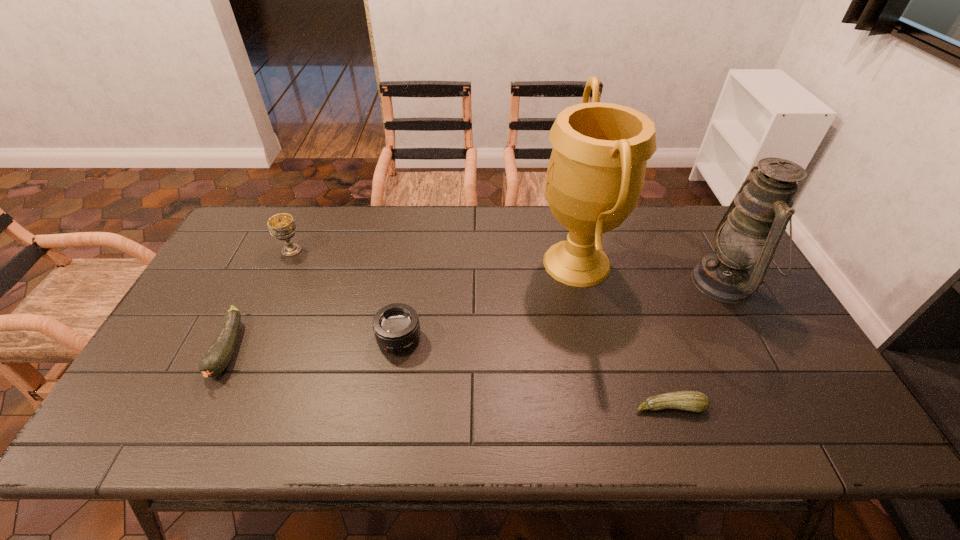
This screenshot has height=540, width=960. What are the coordinates of `vacant space that satisfies the following two spatial constraints: 1. on the engravings side of the tallest object; 2. at the blossom end of the taller zucchini` in the screenshot? It's located at [x=596, y=350].

Where is `vacant space that satisfies the following two spatial constraints: 1. on the engravings side of the tallest object; 2. on the side of the telephoto lens with brand markings and control switches`? vacant space that satisfies the following two spatial constraints: 1. on the engravings side of the tallest object; 2. on the side of the telephoto lens with brand markings and control switches is located at coordinates (594, 339).